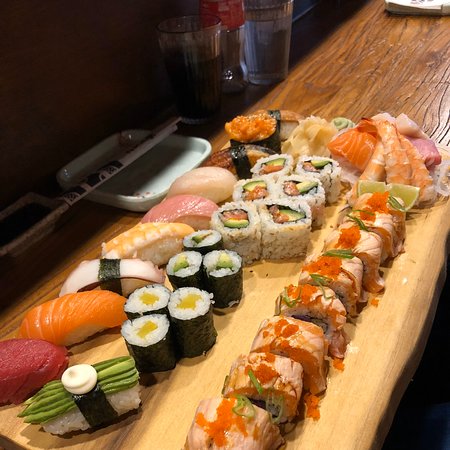
At what (x,y) coordinates should I click in order to perform the action: click on white dish. Please return your answer as a coordinate pair (x, y). Looking at the image, I should click on (143, 187).